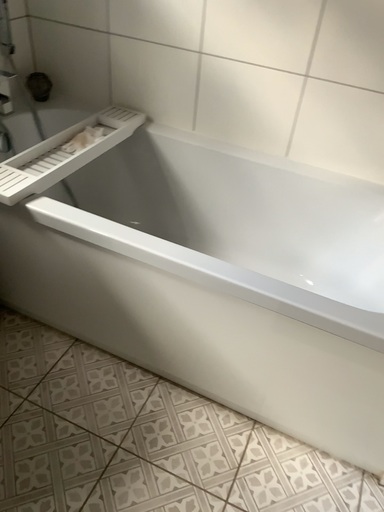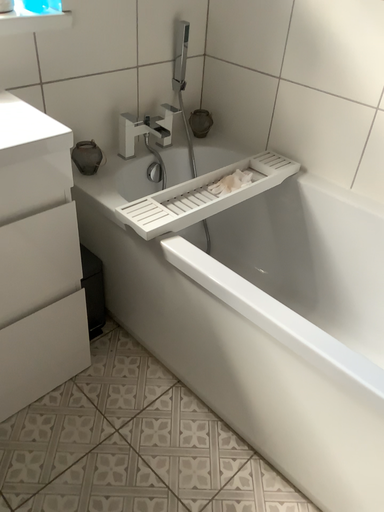
Question: Which way did the camera rotate in the video?

Choices:
 (A) rotated left
 (B) rotated right

Answer: (A)